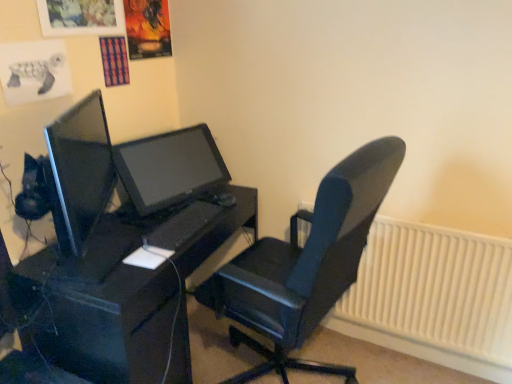
You are a GUI agent. You are given a task and a screenshot of the screen. Output one action in this format:
    pyautogui.click(x=<x>, y=<y>)
    Task: Click on the vacant space to the left of black matte keyboard at center
    Image resolution: width=512 pixels, height=384 pixels.
    Given the screenshot: What is the action you would take?
    pyautogui.click(x=132, y=221)